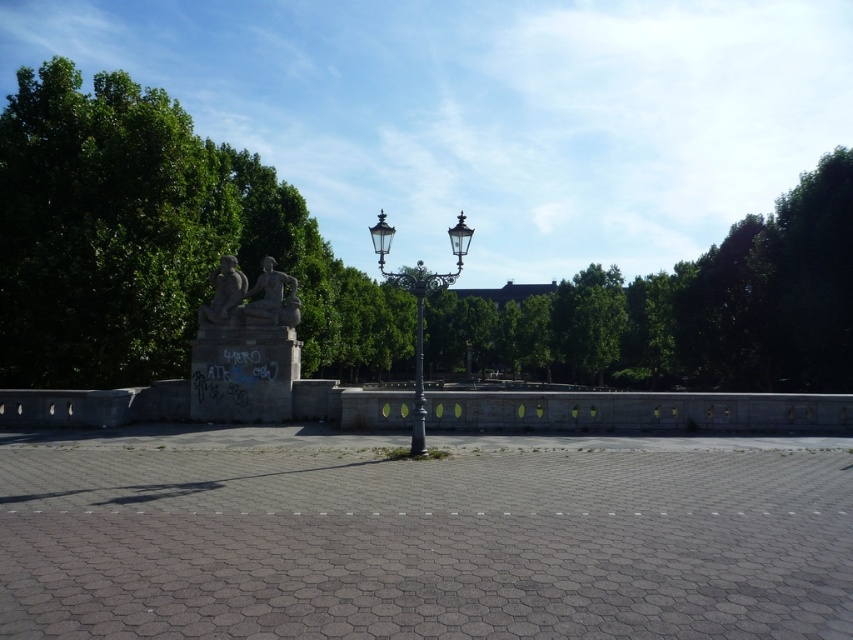
Question: Does polished brass lamp post at center have a smaller size compared to stone statue at center?

Choices:
 (A) yes
 (B) no

Answer: (B)

Question: Is polished bronze statue at center thinner than stone statue at center?

Choices:
 (A) no
 (B) yes

Answer: (A)

Question: Which of these objects is positioned farthest from the green leafy tree at center?

Choices:
 (A) stone statue at center
 (B) polished bronze statue at center

Answer: (B)

Question: Can you confirm if green leafy tree at center is wider than polished brass lamp post at center?

Choices:
 (A) no
 (B) yes

Answer: (B)

Question: Which object is the closest to the polished brass lamp post at center?

Choices:
 (A) green leafy tree at center
 (B) stone statue at center
 (C) polished bronze statue at center

Answer: (B)

Question: Which of the following is the farthest from the observer?

Choices:
 (A) polished bronze statue at center
 (B) polished brass lamp post at center

Answer: (A)